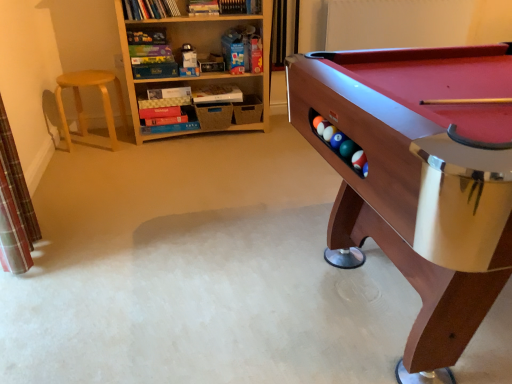
Question: Is point (98, 142) closer or farther from the camera than point (133, 96)?

Choices:
 (A) closer
 (B) farther

Answer: (B)

Question: In the image, is light brown wooden stool at left positioned in front of or behind wooden bookshelf at upper left?

Choices:
 (A) front
 (B) behind

Answer: (B)

Question: Estimate the real-world distances between objects in this image. Which object is farther from the wooden pool table at right?

Choices:
 (A) light brown wooden stool at left
 (B) wooden bookshelf at upper left

Answer: (A)

Question: Which object is positioned farthest from the wooden bookshelf at upper left?

Choices:
 (A) light brown wooden stool at left
 (B) wooden pool table at right

Answer: (B)